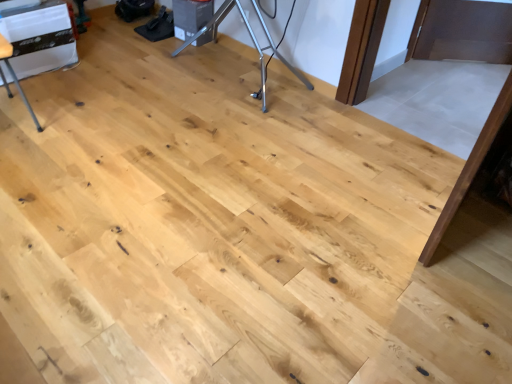
Question: Considering the positions of matte white appliance at left and silver metallic tripod at center in the image, is matte white appliance at left taller or shorter than silver metallic tripod at center?

Choices:
 (A) short
 (B) tall

Answer: (B)

Question: From the image's perspective, is matte white appliance at left positioned above or below silver metallic tripod at center?

Choices:
 (A) above
 (B) below

Answer: (B)

Question: Which object is positioned closest to the silver metallic tripod at center?

Choices:
 (A) matte white appliance at left
 (B) white plastic table at upper left

Answer: (B)

Question: Which object is the farthest from the matte white appliance at left?

Choices:
 (A) white plastic table at upper left
 (B) silver metallic tripod at center

Answer: (B)